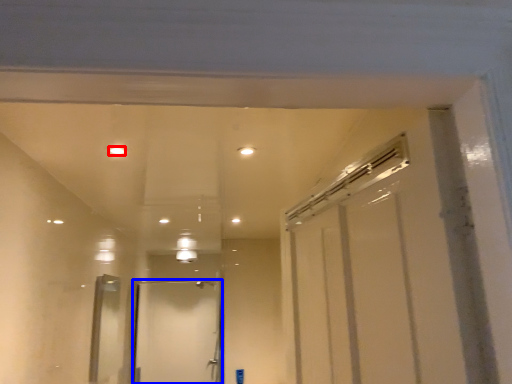
Question: Among these objects, which one is nearest to the camera, light (highlighted by a red box) or door (highlighted by a blue box)?

Choices:
 (A) light
 (B) door

Answer: (A)